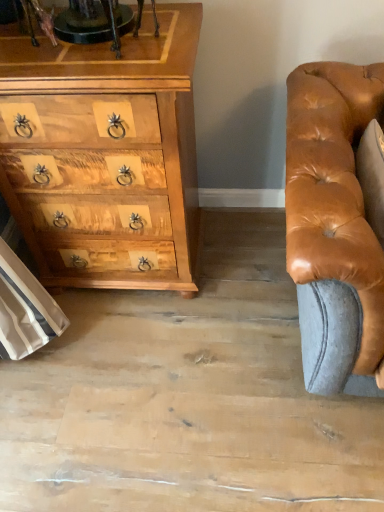
Locate an element on the screen. The width and height of the screenshot is (384, 512). vacant area that lies to the right of natural wood chest of drawers at left is located at coordinates (245, 267).